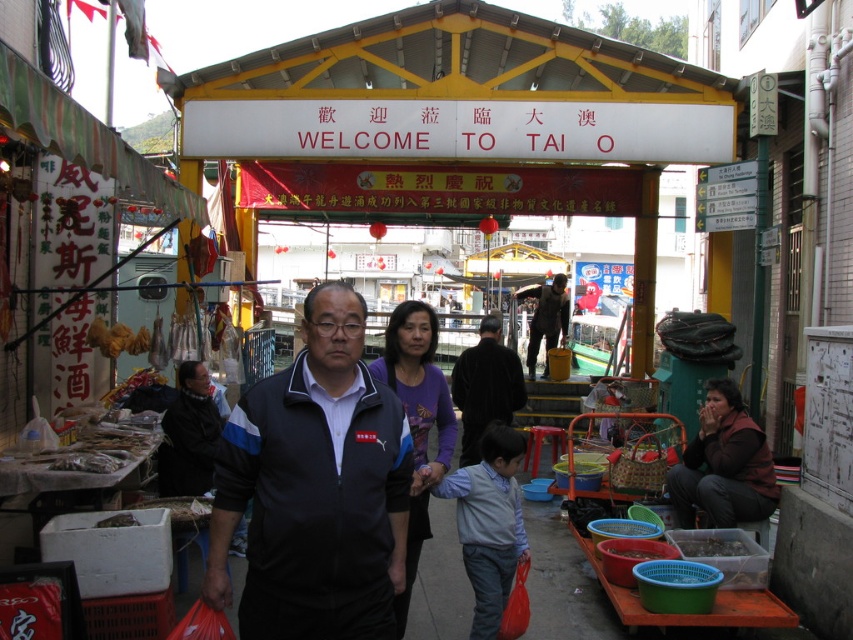
You are a photographer trying to capture the vibrant colors of the market. You notice two people wearing a purple matte shirt at center and a dark brown leather jacket at center. Which clothing item is positioned to the left of the other?

The purple matte shirt at center is to the left of the dark brown leather jacket at center.

You are a customer at the market and notice two people wearing the purple matte shirt at center and the dark brown leather jacket at center. Which person is shorter in height?

The purple matte shirt at center is shorter than the dark brown leather jacket at center, so the person wearing the purple matte shirt at center is shorter in height.